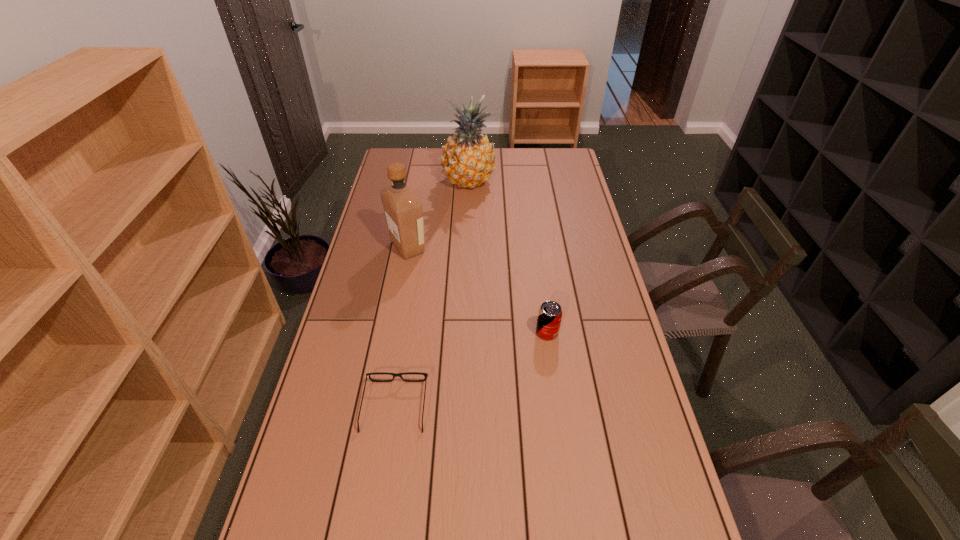
At what (x,y) coordinates should I click in order to perform the action: click on the farthest object. Please return your answer as a coordinate pair (x, y). The width and height of the screenshot is (960, 540). Looking at the image, I should click on (468, 160).

Locate an element on the screen. The width and height of the screenshot is (960, 540). the third nearest object is located at coordinates (403, 211).

Locate an element on the screen. the second shortest object is located at coordinates (549, 318).

Identify the location of soda can. point(549,318).

The height and width of the screenshot is (540, 960). Identify the location of spectacles. (394, 375).

This screenshot has width=960, height=540. Find the location of `the shortest object`. the shortest object is located at coordinates (394, 375).

Where is `vacant area located 0.180m on the right of the pineapple`? This screenshot has height=540, width=960. vacant area located 0.180m on the right of the pineapple is located at coordinates (535, 182).

Image resolution: width=960 pixels, height=540 pixels. In order to click on vacant space situated 0.380m on the front-facing side of the second farthest object in this screenshot , I will do `click(527, 247)`.

What are the coordinates of `vacant area situated 0.290m on the back of the rightmost object` in the screenshot? It's located at (538, 263).

Locate an element on the screen. The width and height of the screenshot is (960, 540). vacant region located 0.060m on the front-facing side of the spectacles is located at coordinates (401, 363).